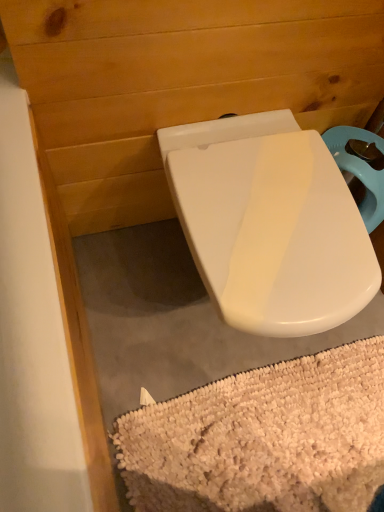
Question: From the image's perspective, is white glossy toilet seat at center under white shaggy bath mat at lower center?

Choices:
 (A) yes
 (B) no

Answer: (B)

Question: Is white glossy toilet seat at center completely or partially outside of white shaggy bath mat at lower center?

Choices:
 (A) no
 (B) yes

Answer: (B)

Question: Considering the relative positions of white glossy toilet seat at center and white shaggy bath mat at lower center in the image provided, is white glossy toilet seat at center to the left of white shaggy bath mat at lower center from the viewer's perspective?

Choices:
 (A) no
 (B) yes

Answer: (B)

Question: Is there a large distance between white glossy toilet seat at center and white shaggy bath mat at lower center?

Choices:
 (A) no
 (B) yes

Answer: (A)

Question: From a real-world perspective, is white glossy toilet seat at center physically below white shaggy bath mat at lower center?

Choices:
 (A) no
 (B) yes

Answer: (A)

Question: Does white glossy toilet seat at center have a lesser width compared to white shaggy bath mat at lower center?

Choices:
 (A) no
 (B) yes

Answer: (A)

Question: Is white shaggy bath mat at lower center bigger than white glossy toilet seat at center?

Choices:
 (A) no
 (B) yes

Answer: (A)

Question: Would you say white shaggy bath mat at lower center is a long distance from white glossy toilet seat at center?

Choices:
 (A) no
 (B) yes

Answer: (A)

Question: Is white shaggy bath mat at lower center at the right side of white glossy toilet seat at center?

Choices:
 (A) no
 (B) yes

Answer: (B)

Question: Is white shaggy bath mat at lower center not within white glossy toilet seat at center?

Choices:
 (A) yes
 (B) no

Answer: (A)

Question: Is white shaggy bath mat at lower center oriented towards white glossy toilet seat at center?

Choices:
 (A) yes
 (B) no

Answer: (B)

Question: Does white shaggy bath mat at lower center come behind white glossy toilet seat at center?

Choices:
 (A) yes
 (B) no

Answer: (A)

Question: From a real-world perspective, is white glossy toilet seat at center positioned above or below white shaggy bath mat at lower center?

Choices:
 (A) below
 (B) above

Answer: (B)